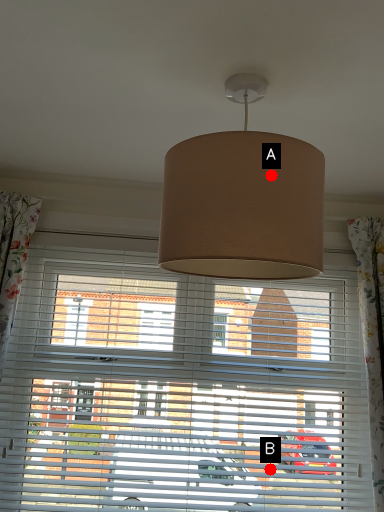
Question: Two points are circled on the image, labeled by A and B beside each circle. Which point is farther to the camera?

Choices:
 (A) A is further
 (B) B is further

Answer: (B)